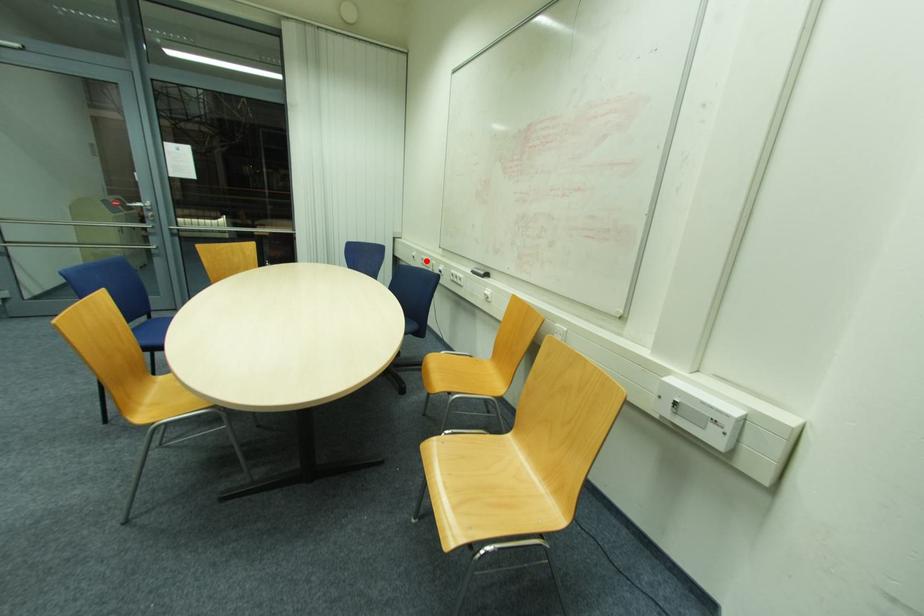
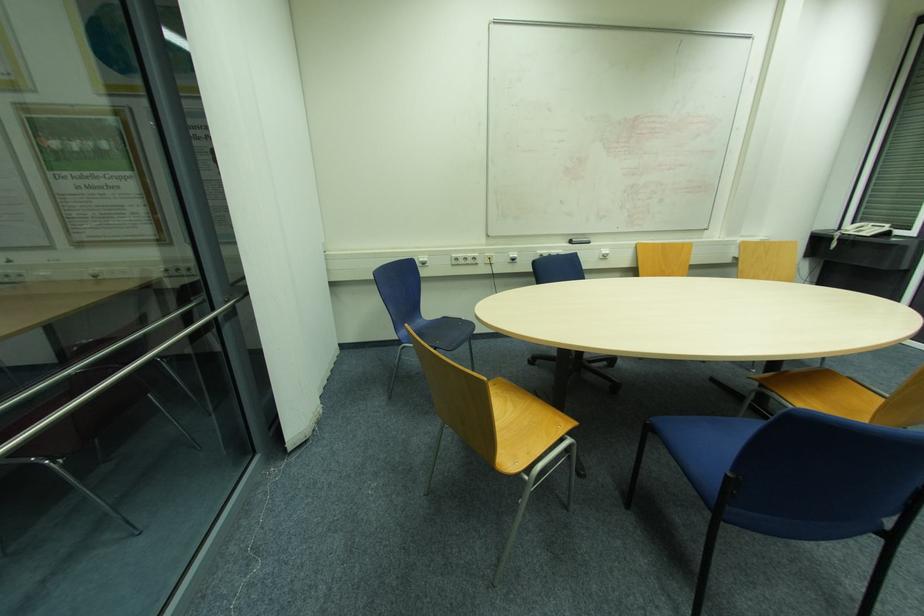
The point at the highlighted location is marked in the first image. Where is the corresponding point in the second image?

(467, 259)